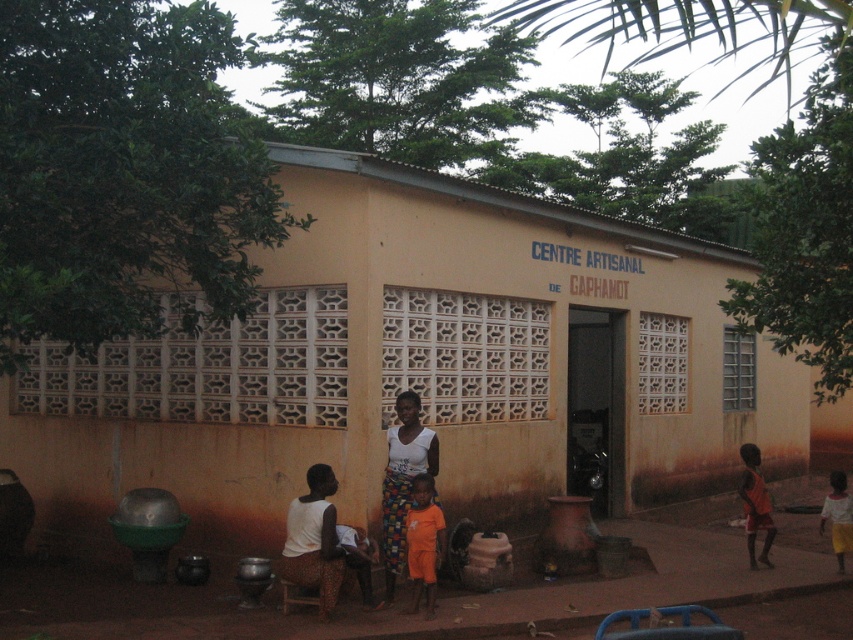
Who is positioned more to the right, orange fabric at center or orange cotton shirt at lower center?

orange fabric at center

Which is in front, point (430, 600) or point (373, 547)?

Point (430, 600)

Does point (442, 532) come closer to viewer compared to point (370, 580)?

Yes, point (442, 532) is in front of point (370, 580).

Locate an element on the screen. The height and width of the screenshot is (640, 853). orange fabric at center is located at coordinates (422, 541).

Is yellow matte building at center positioned behind orange fabric child at lower right?

No, yellow matte building at center is closer to the viewer.

This screenshot has height=640, width=853. In order to click on yellow matte building at center in this screenshot , I will do (418, 365).

You are a GUI agent. You are given a task and a screenshot of the screen. Output one action in this format:
    pyautogui.click(x=<x>, y=<y>)
    Task: Click on the yellow matte building at center
    
    Given the screenshot: What is the action you would take?
    pyautogui.click(x=418, y=365)

Who is positioned more to the right, orange fabric child at lower right or orange cotton shirt at lower center?

orange fabric child at lower right

In the scene shown: Between orange fabric child at lower right and orange cotton shirt at lower center, which one is positioned higher?

→ orange fabric child at lower right

Is point (764, 540) more distant than point (349, 525)?

Yes, point (764, 540) is farther from viewer.

Identify the location of orange fabric child at lower right. This screenshot has width=853, height=640. (755, 504).